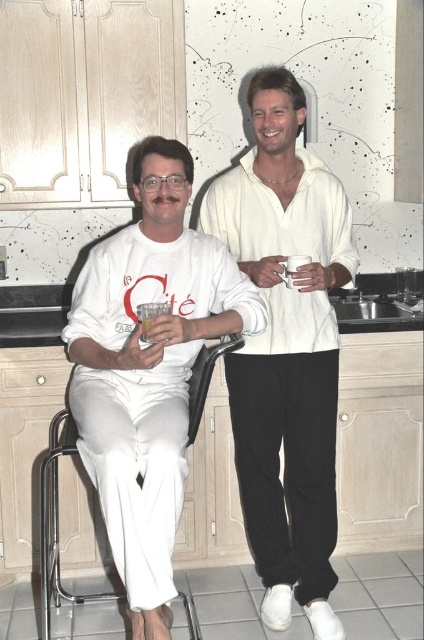
You are a photographer trying to capture a candid shot of the scene. You notice the white matte shirt at left and the translucent glass at left. Which object should you focus on first if you want to ensure both are in focus, considering their sizes in the frame?

The white matte shirt at left has a greater height compared to the translucent glass at left, so focusing on the taller white matte shirt at left first would help ensure both are in focus as it occupies more space in the frame.

You are a photographer trying to capture a candid shot of the two people in the kitchen. The camera you are using has a maximum focus range of 2 meters. Can you take a photo of both the white matte shirt at center and the other person without moving the camera?

The two individuals are 2.17 meters apart, which exceeds the camera maximum focus range of 2 meters. Therefore, you cannot take a photo of both the white matte shirt at center and the other person without moving the camera.

You are a photographer setting up a shoot in this kitchen scene. You need to ensure that the white matte shirt at left and the translucent glass at left are both visible in the frame. Given their sizes, which object should you prioritize framing closer to the camera to maintain clarity?

The white matte shirt at left has a larger size compared to the translucent glass at left, so you should prioritize framing the white matte shirt at left closer to the camera to maintain clarity.